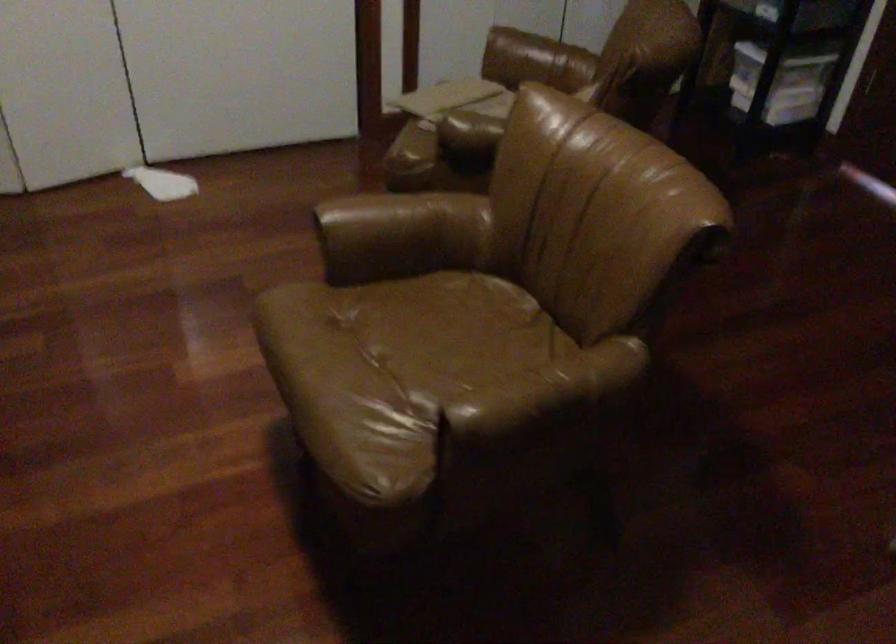
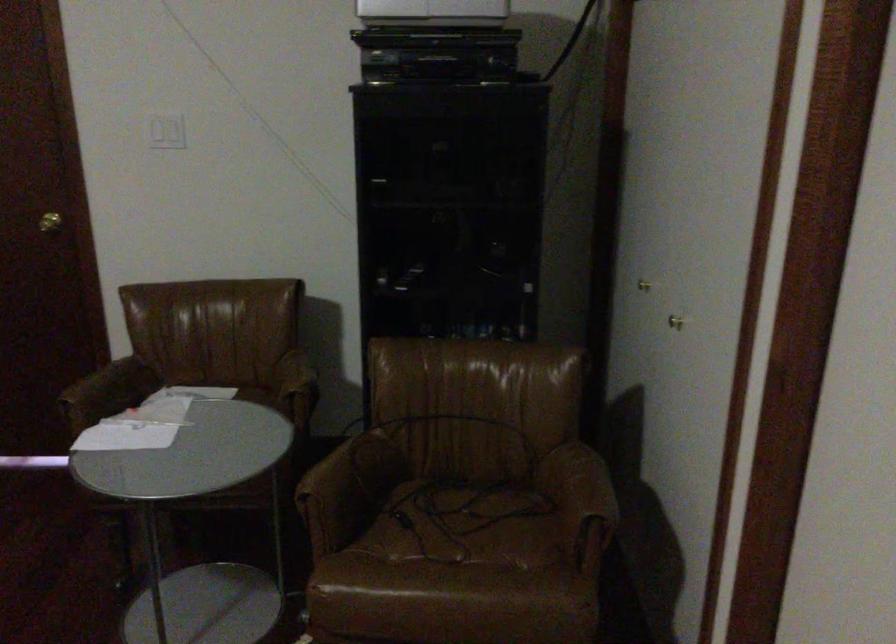
Question: The images are taken continuously from a first-person perspective. In which direction is your viewpoint rotating?

Choices:
 (A) Left
 (B) Right
 (C) Up
 (D) Down

Answer: (B)